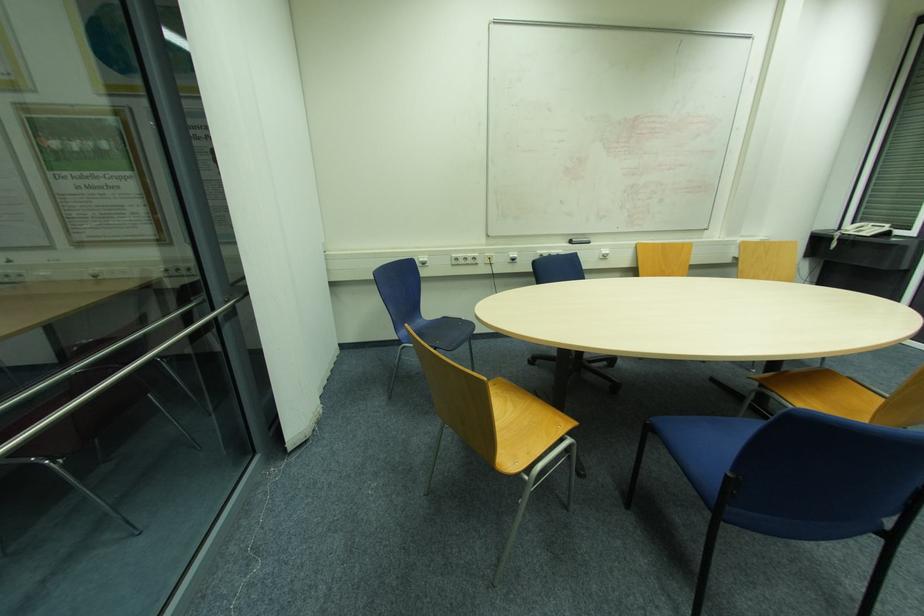
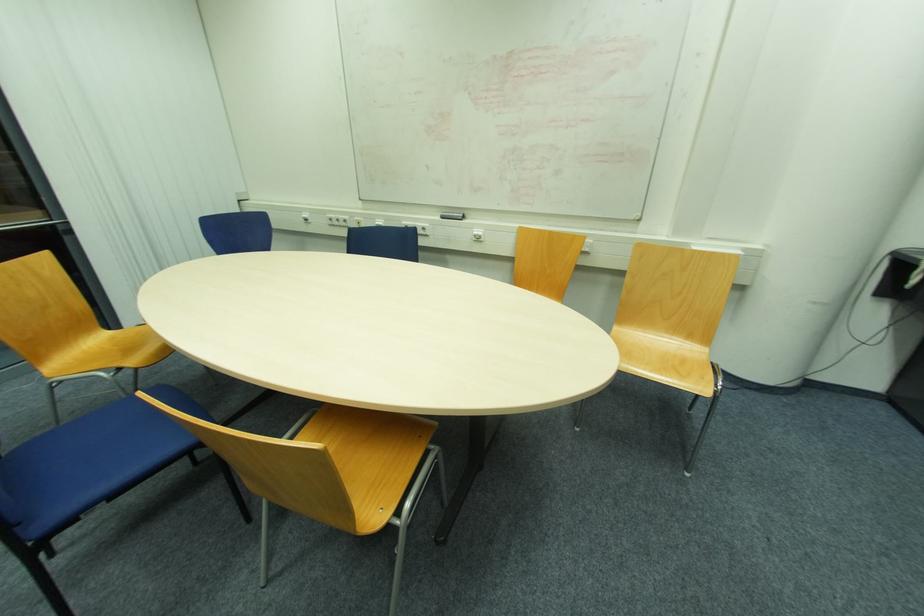
Find the pixel in the second image that matches the point at 574,244 in the first image.

(444, 217)